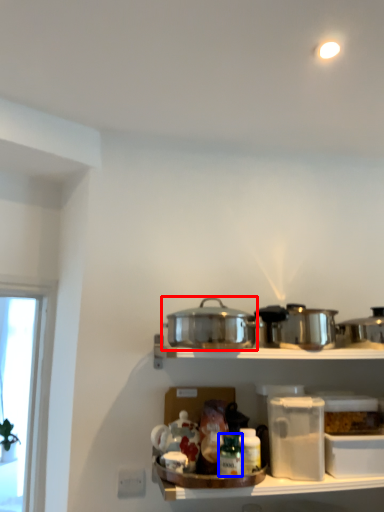
Question: Which of the following is the farthest to the observer, crock pot (highlighted by a red box) or bottle (highlighted by a blue box)?

Choices:
 (A) crock pot
 (B) bottle

Answer: (B)